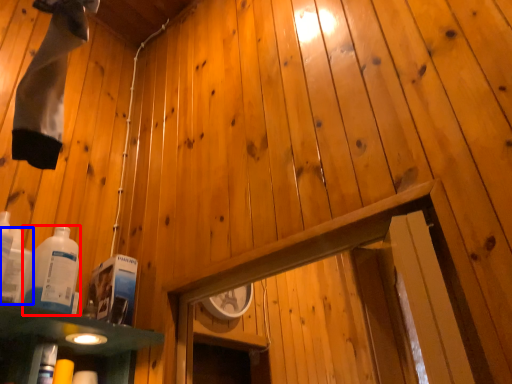
Question: Which of the following is the farthest to the observer, bottle (highlighted by a red box) or bottle (highlighted by a blue box)?

Choices:
 (A) bottle
 (B) bottle

Answer: (A)